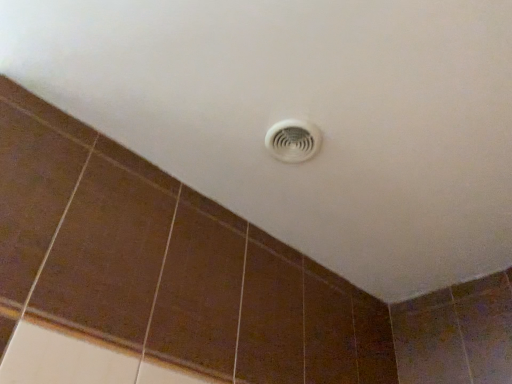
What do you see at coordinates (293, 140) in the screenshot? The image size is (512, 384). I see `white plastic vent at center` at bounding box center [293, 140].

You are a GUI agent. You are given a task and a screenshot of the screen. Output one action in this format:
    pyautogui.click(x=<x>, y=<y>)
    Task: Click on the white plastic vent at center
    The width and height of the screenshot is (512, 384).
    Given the screenshot: What is the action you would take?
    pyautogui.click(x=293, y=140)

Find the location of a particular element. Image resolution: width=512 pixels, height=384 pixels. white plastic vent at center is located at coordinates (293, 140).